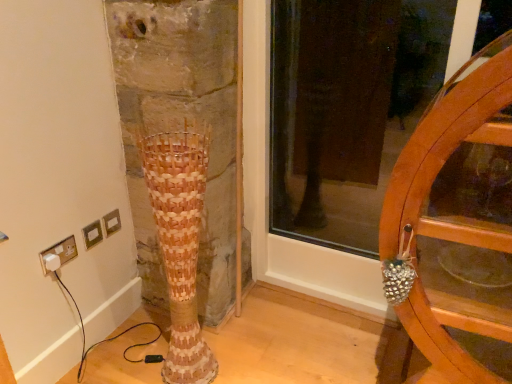
Question: Does white plastic plug at lower left lie behind woven wood vase at center?

Choices:
 (A) no
 (B) yes

Answer: (B)

Question: Is white plastic plug at lower left thinner than woven wood vase at center?

Choices:
 (A) no
 (B) yes

Answer: (B)

Question: Is white plastic plug at lower left positioned before woven wood vase at center?

Choices:
 (A) no
 (B) yes

Answer: (A)

Question: Is white plastic plug at lower left oriented towards woven wood vase at center?

Choices:
 (A) no
 (B) yes

Answer: (B)

Question: Does white plastic plug at lower left appear on the left side of woven wood vase at center?

Choices:
 (A) yes
 (B) no

Answer: (A)

Question: From the image's perspective, relative to wooden wheel at right, is white plastic plug at lower left above or below?

Choices:
 (A) above
 (B) below

Answer: (B)

Question: Considering the positions of white plastic plug at lower left and wooden wheel at right in the image, is white plastic plug at lower left bigger or smaller than wooden wheel at right?

Choices:
 (A) big
 (B) small

Answer: (B)

Question: Is white plastic plug at lower left taller or shorter than wooden wheel at right?

Choices:
 (A) tall
 (B) short

Answer: (B)

Question: Considering the positions of point pos(64,243) and point pos(446,299), is point pos(64,243) closer or farther from the camera than point pos(446,299)?

Choices:
 (A) closer
 (B) farther

Answer: (B)

Question: Looking at their shapes, would you say white plastic plug at lower left is wider or thinner than woven wood vase at center?

Choices:
 (A) wide
 (B) thin

Answer: (B)

Question: Is white plastic plug at lower left to the left or to the right of woven wood vase at center in the image?

Choices:
 (A) right
 (B) left

Answer: (B)

Question: From the image's perspective, is white plastic plug at lower left positioned above or below woven wood vase at center?

Choices:
 (A) above
 (B) below

Answer: (A)

Question: Is white plastic plug at lower left bigger or smaller than woven wood vase at center?

Choices:
 (A) small
 (B) big

Answer: (A)

Question: Relative to white plastic plug at lower left, is woven wood vase at center in front or behind?

Choices:
 (A) front
 (B) behind

Answer: (A)

Question: Considering the positions of point [180, 148] and point [55, 251], is point [180, 148] closer or farther from the camera than point [55, 251]?

Choices:
 (A) closer
 (B) farther

Answer: (A)